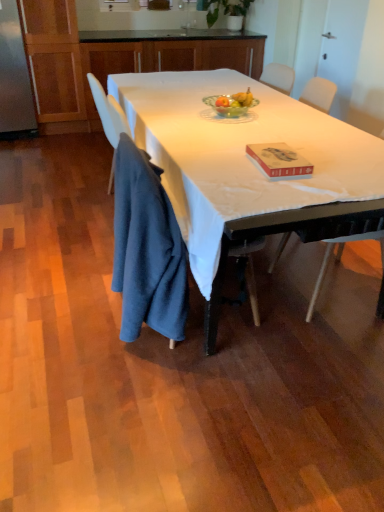
Locate an element on the screen. The image size is (384, 512). vacant space to the right of green glass bowl at center is located at coordinates point(276,116).